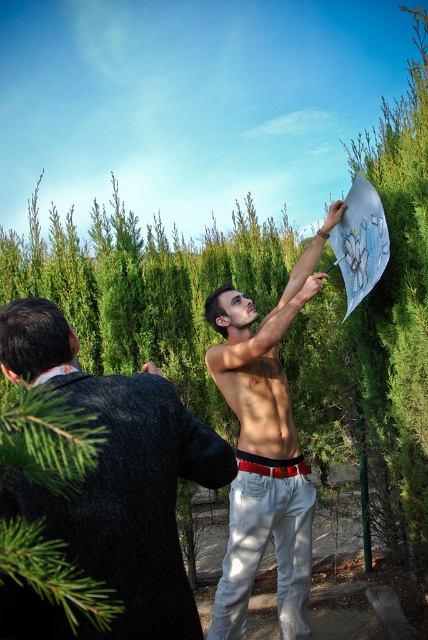
Can you confirm if smooth gray suit at left is positioned above shiny metallic shirt at center?

Yes, smooth gray suit at left is above shiny metallic shirt at center.

Based on the photo, who is more distant from viewer, (154,385) or (308,266)?

The point (308,266) is more distant.

The height and width of the screenshot is (640, 428). Find the location of `smooth gray suit at left`. smooth gray suit at left is located at coordinates (118, 476).

Between smooth gray suit at left and muscular tan skin at center, which one has more height?

smooth gray suit at left

Does smooth gray suit at left appear over muscular tan skin at center?

Actually, smooth gray suit at left is below muscular tan skin at center.

Is point (77, 518) less distant than point (249, 408)?

Yes, it is.

Locate an element on the screen. smooth gray suit at left is located at coordinates (118, 476).

Is shiny metallic shirt at center positioned in front of muscular tan skin at center?

That is True.

Can you confirm if shiny metallic shirt at center is positioned below muscular tan skin at center?

Correct, shiny metallic shirt at center is located below muscular tan skin at center.

Is point (297, 461) farther from camera compared to point (250, 440)?

Yes, it is.

This screenshot has height=640, width=428. I want to click on shiny metallic shirt at center, so click(264, 449).